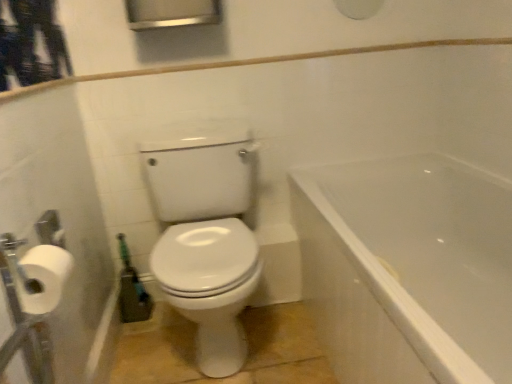
Question: Is point (396, 238) closer or farther from the camera than point (40, 294)?

Choices:
 (A) farther
 (B) closer

Answer: (A)

Question: Relative to white matte toilet paper at left, is white glossy bathtub at right in front or behind?

Choices:
 (A) front
 (B) behind

Answer: (A)

Question: From the image's perspective, is white glossy bathtub at right located above or below white matte toilet paper at left?

Choices:
 (A) above
 (B) below

Answer: (B)

Question: In the image, is white matte toilet paper at left on the left side or the right side of white glossy bathtub at right?

Choices:
 (A) right
 (B) left

Answer: (B)

Question: Is point (23, 311) closer or farther from the camera than point (437, 248)?

Choices:
 (A) closer
 (B) farther

Answer: (A)

Question: From a real-world perspective, relative to white glossy bathtub at right, is white matte toilet paper at left vertically above or below?

Choices:
 (A) above
 (B) below

Answer: (A)

Question: In terms of width, does white matte toilet paper at left look wider or thinner when compared to white glossy bathtub at right?

Choices:
 (A) wide
 (B) thin

Answer: (B)